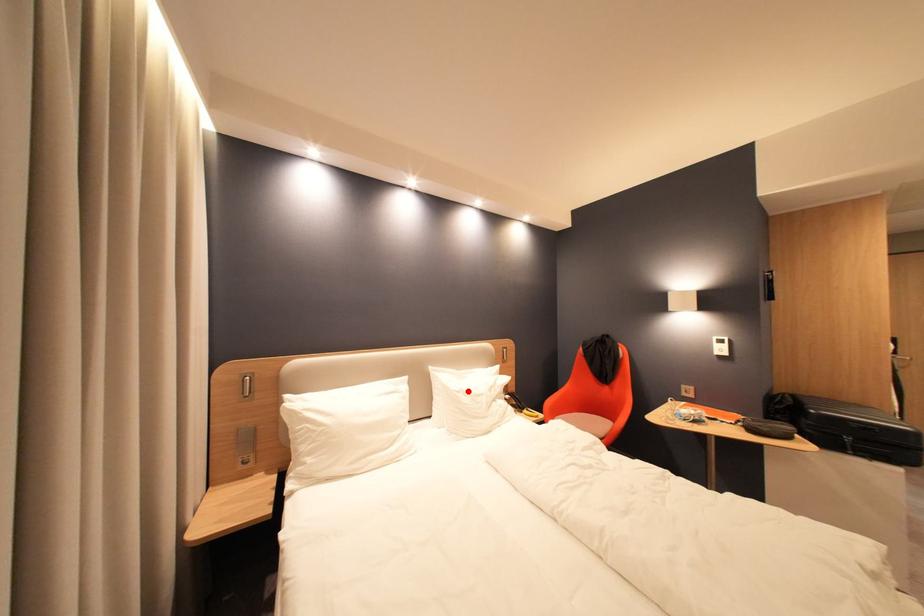
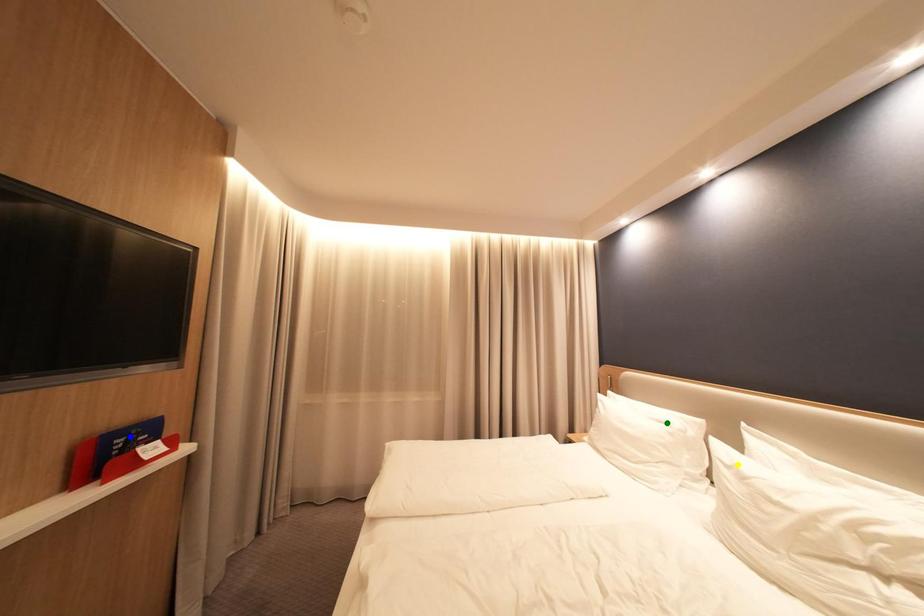
Question: I am providing you with two images of the same scene from different viewpoints. A red point is marked on the first image. You are given multiple points on the second image. Can you choose the point in image 2 that corresponds to the point in image 1?

Choices:
 (A) yellow point
 (B) green point
 (C) blue point

Answer: (A)